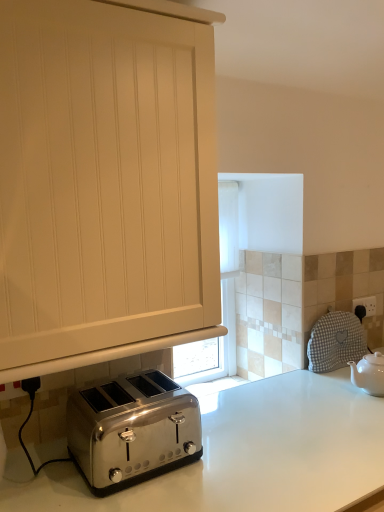
Question: Can you confirm if white ceramic teapot at right is positioned to the right of white glossy countertop at lower center?

Choices:
 (A) yes
 (B) no

Answer: (A)

Question: From a real-world perspective, is white ceramic teapot at right below white glossy countertop at lower center?

Choices:
 (A) no
 (B) yes

Answer: (A)

Question: Is white ceramic teapot at right positioned before white glossy countertop at lower center?

Choices:
 (A) yes
 (B) no

Answer: (B)

Question: Could you tell me if white ceramic teapot at right is facing white glossy countertop at lower center?

Choices:
 (A) no
 (B) yes

Answer: (A)

Question: From the image's perspective, is white ceramic teapot at right below white glossy countertop at lower center?

Choices:
 (A) no
 (B) yes

Answer: (A)

Question: Considering the relative sizes of white ceramic teapot at right and white glossy countertop at lower center in the image provided, is white ceramic teapot at right smaller than white glossy countertop at lower center?

Choices:
 (A) yes
 (B) no

Answer: (A)

Question: From the image's perspective, would you say white wood cabinet at center is positioned over black plastic electric outlet at upper right?

Choices:
 (A) yes
 (B) no

Answer: (A)

Question: Does white wood cabinet at center appear on the left side of black plastic electric outlet at upper right?

Choices:
 (A) yes
 (B) no

Answer: (A)

Question: Is white wood cabinet at center oriented towards black plastic electric outlet at upper right?

Choices:
 (A) yes
 (B) no

Answer: (B)

Question: Can you confirm if white wood cabinet at center is wider than black plastic electric outlet at upper right?

Choices:
 (A) yes
 (B) no

Answer: (A)

Question: Is black plastic electric outlet at upper right completely or partially inside white wood cabinet at center?

Choices:
 (A) yes
 (B) no

Answer: (B)

Question: Is white wood cabinet at center further to the viewer compared to black plastic electric outlet at upper right?

Choices:
 (A) yes
 (B) no

Answer: (B)

Question: From a real-world perspective, is white wood cabinet at center on top of white glossy countertop at lower center?

Choices:
 (A) yes
 (B) no

Answer: (A)